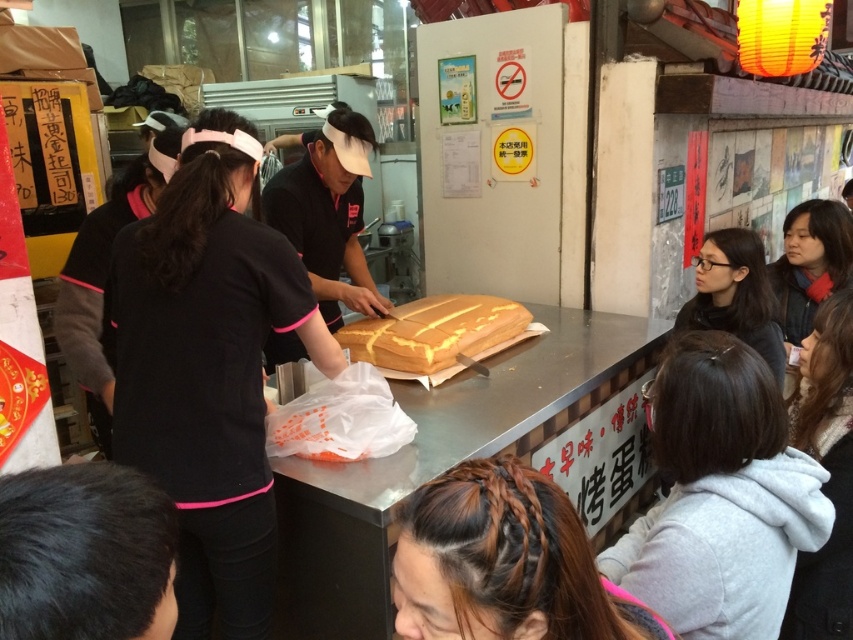
Question: Is black matte shirt at center positioned in front of black fabric jacket at left?

Choices:
 (A) no
 (B) yes

Answer: (B)

Question: Is light brown hair at lower right wider than matte black hair at right?

Choices:
 (A) yes
 (B) no

Answer: (A)

Question: Which object appears closest to the camera in this image?

Choices:
 (A) black hair at lower left
 (B) brown braided hair at lower center
 (C) black fabric jacket at left
 (D) matte black hair at right

Answer: (A)

Question: Which point is closer to the camera?

Choices:
 (A) black matte shirt at center
 (B) black hair at lower left
 (C) matte black hair at right
 (D) light brown hair at lower right

Answer: (B)

Question: Is black fabric jacket at left smaller than matte black hair at right?

Choices:
 (A) yes
 (B) no

Answer: (B)

Question: Which is nearer to the black hair at lower left?

Choices:
 (A) smooth black hair at upper right
 (B) light brown hair at lower right
 (C) gray fleece at lower right
 (D) black fabric jacket at left

Answer: (C)